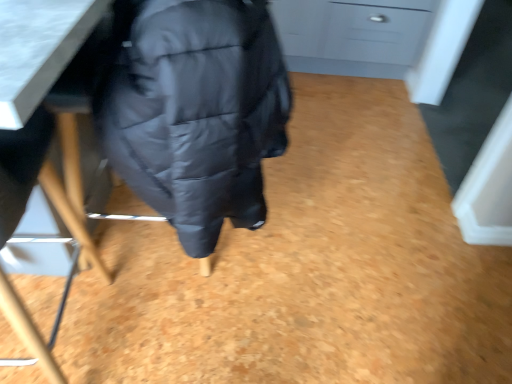
Question: Could you tell me if matte black jacket at under table is facing matte gray drawer at upper right?

Choices:
 (A) yes
 (B) no

Answer: (B)

Question: Is matte black jacket at under table shorter than matte gray drawer at upper right?

Choices:
 (A) yes
 (B) no

Answer: (B)

Question: From the image's perspective, is matte black jacket at under table under matte gray drawer at upper right?

Choices:
 (A) yes
 (B) no

Answer: (A)

Question: Is matte black jacket at under table behind matte gray drawer at upper right?

Choices:
 (A) yes
 (B) no

Answer: (B)

Question: Is matte black jacket at under table looking in the opposite direction of matte gray drawer at upper right?

Choices:
 (A) no
 (B) yes

Answer: (A)

Question: Can you confirm if matte black jacket at under table is positioned to the right of matte gray drawer at upper right?

Choices:
 (A) no
 (B) yes

Answer: (A)

Question: From the image's perspective, would you say matte black jacket at under table is positioned over matte black chair at lower left?

Choices:
 (A) yes
 (B) no

Answer: (A)

Question: Does matte black jacket at under table appear on the left side of matte black chair at lower left?

Choices:
 (A) yes
 (B) no

Answer: (B)

Question: Is matte black jacket at under table not near matte black chair at lower left?

Choices:
 (A) no
 (B) yes

Answer: (A)

Question: From the image's perspective, is matte black jacket at under table located beneath matte black chair at lower left?

Choices:
 (A) yes
 (B) no

Answer: (B)

Question: Is matte black jacket at under table at the right side of matte black chair at lower left?

Choices:
 (A) no
 (B) yes

Answer: (B)

Question: Are matte black jacket at under table and matte black chair at lower left beside each other?

Choices:
 (A) no
 (B) yes

Answer: (A)

Question: Is matte gray drawer at upper right positioned beyond the bounds of matte black chair at lower left?

Choices:
 (A) yes
 (B) no

Answer: (A)